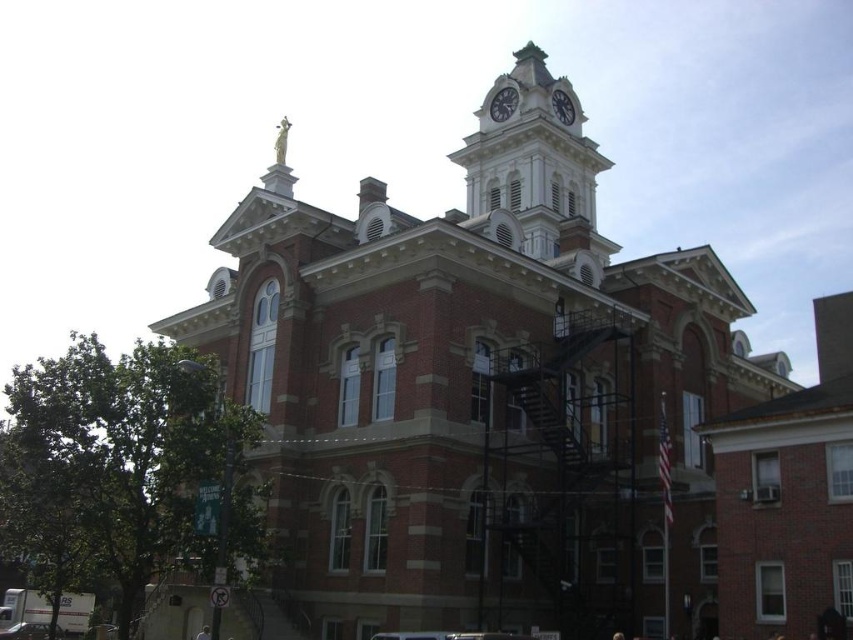
Question: Which object is the farthest from the red brick church at center?

Choices:
 (A) white glossy clock at upper center
 (B) white stone clock at upper center

Answer: (A)

Question: From the image, what is the correct spatial relationship of white stone clock tower at upper center in relation to white stone clock at upper center?

Choices:
 (A) left
 (B) right

Answer: (B)

Question: Does red brick church at center appear on the left side of white stone clock tower at upper center?

Choices:
 (A) yes
 (B) no

Answer: (A)

Question: Based on their relative distances, which object is nearer to the white stone clock at upper center?

Choices:
 (A) red brick church at center
 (B) white stone clock tower at upper center

Answer: (B)

Question: Can you confirm if white stone clock tower at upper center is wider than white glossy clock at upper center?

Choices:
 (A) yes
 (B) no

Answer: (A)

Question: Which point is closer to the camera?

Choices:
 (A) 527,108
 (B) 497,109
 (C) 567,108
 (D) 477,516

Answer: (D)